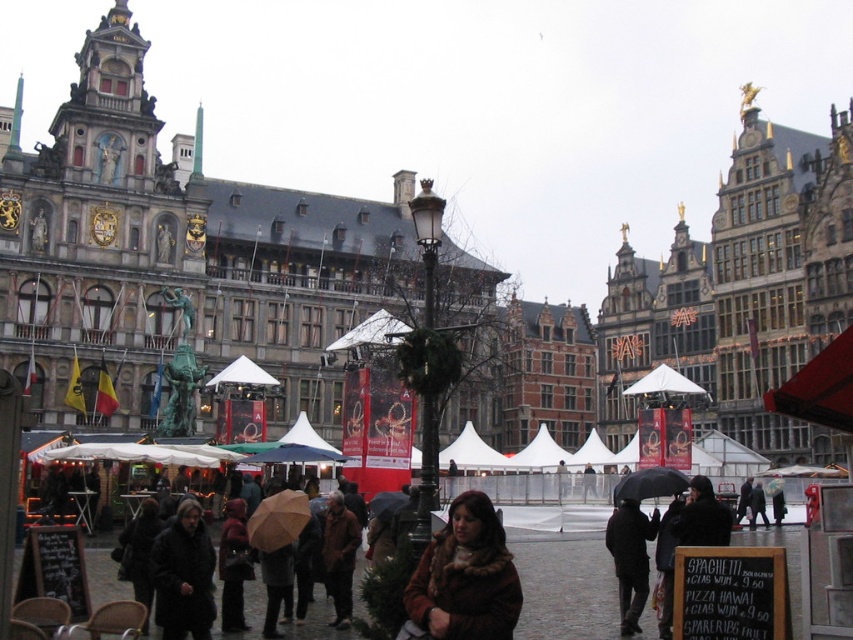
Question: Which point is farther from the camera taking this photo?

Choices:
 (A) (204, 563)
 (B) (422, 563)
 (C) (624, 621)

Answer: (C)

Question: Does brown fur coat at center have a lesser width compared to dark brown leather coat at lower left?

Choices:
 (A) no
 (B) yes

Answer: (A)

Question: Is brown fur coat at center in front of dark brown leather coat at lower left?

Choices:
 (A) no
 (B) yes

Answer: (B)

Question: Which of these objects is positioned closest to the dark brown leather coat at lower left?

Choices:
 (A) brown woolen coat at center
 (B) dark matte coat at lower center
 (C) brown fur coat at center

Answer: (C)

Question: Where is brown fur coat at center located in relation to brown woolen coat at center in the image?

Choices:
 (A) above
 (B) below

Answer: (A)

Question: Which point is closer to the camera taking this photo?

Choices:
 (A) (589, 468)
 (B) (635, 577)

Answer: (B)